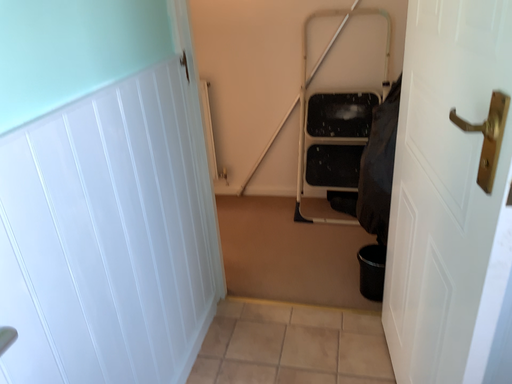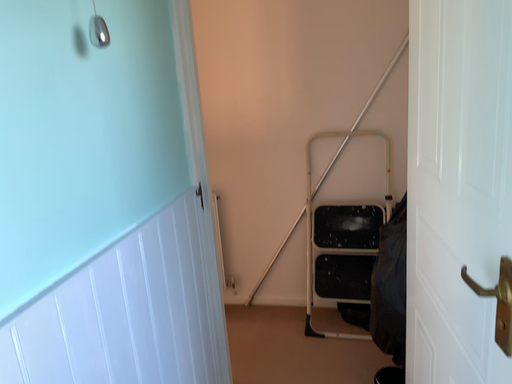
Question: Which way did the camera rotate in the video?

Choices:
 (A) rotated downward
 (B) rotated upward

Answer: (B)